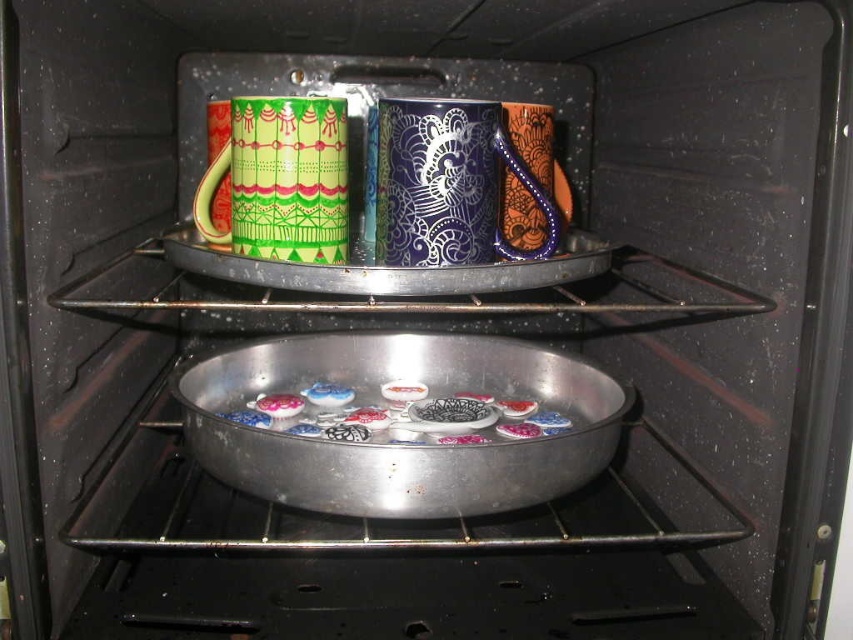
How distant is green glossy mug at upper center from matte ceramic cookie at center?

24.43 centimeters

Between green glossy mug at upper center and matte ceramic cookie at center, which one appears on the left side from the viewer's perspective?

matte ceramic cookie at center

In order to click on green glossy mug at upper center in this screenshot , I will do `click(281, 180)`.

Describe the element at coordinates (281, 180) in the screenshot. I see `green glossy mug at upper center` at that location.

Between green glossy mug at upper center and matte ceramic button at center, which one has less height?

Standing shorter between the two is matte ceramic button at center.

Who is more distant from viewer, (248, 173) or (532, 429)?

Positioned behind is point (532, 429).

Locate an element on the screen. The image size is (853, 640). green glossy mug at upper center is located at coordinates (281, 180).

Which is behind, point (328, 385) or point (302, 408)?

Point (328, 385)

Between shiny metallic cookies at center and matte ceramic cookie at center, which one appears on the left side from the viewer's perspective?

matte ceramic cookie at center

Describe the element at coordinates (383, 413) in the screenshot. I see `shiny metallic cookies at center` at that location.

In order to click on shiny metallic cookies at center in this screenshot , I will do pos(383,413).